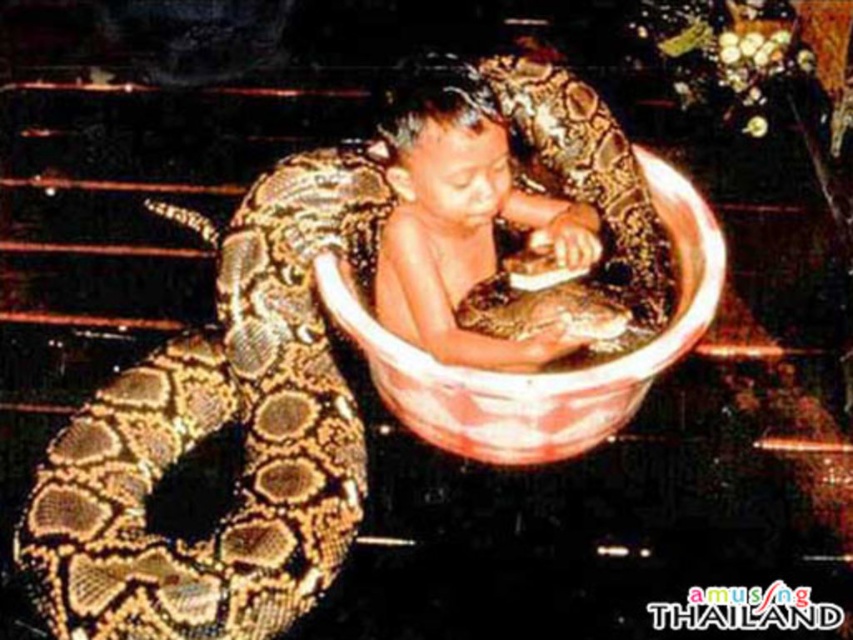
Does smooth skin child at center appear over matte ceramic bowl at center?

Correct, smooth skin child at center is located above matte ceramic bowl at center.

Can you confirm if smooth skin child at center is positioned to the right of matte ceramic bowl at center?

No, smooth skin child at center is not to the right of matte ceramic bowl at center.

Where is `smooth skin child at center`? smooth skin child at center is located at coordinates (461, 221).

Does brown scaly snake at center have a lesser width compared to matte ceramic bowl at center?

Correct, brown scaly snake at center's width is less than matte ceramic bowl at center's.

Is point (131, 602) closer to viewer compared to point (558, 384)?

Yes, point (131, 602) is in front of point (558, 384).

Find the location of `brown scaly snake at center`. brown scaly snake at center is located at coordinates (218, 428).

The height and width of the screenshot is (640, 853). What do you see at coordinates (218, 428) in the screenshot? I see `brown scaly snake at center` at bounding box center [218, 428].

At what (x,y) coordinates should I click in order to perform the action: click on brown scaly snake at center. Please return your answer as a coordinate pair (x, y). The width and height of the screenshot is (853, 640). Looking at the image, I should click on (218, 428).

Is point (320, 227) farther from viewer compared to point (381, 276)?

No.

This screenshot has height=640, width=853. I want to click on brown scaly snake at center, so tap(218, 428).